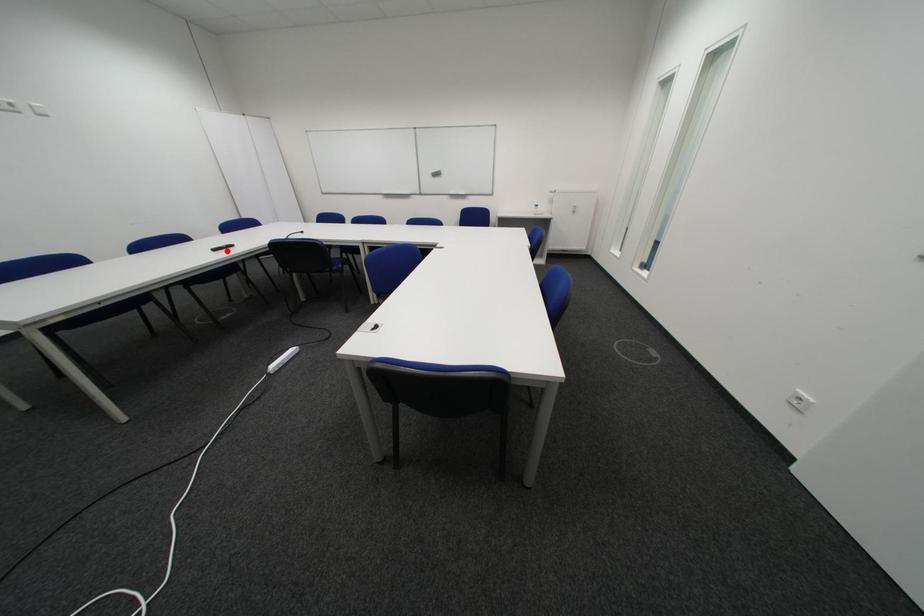
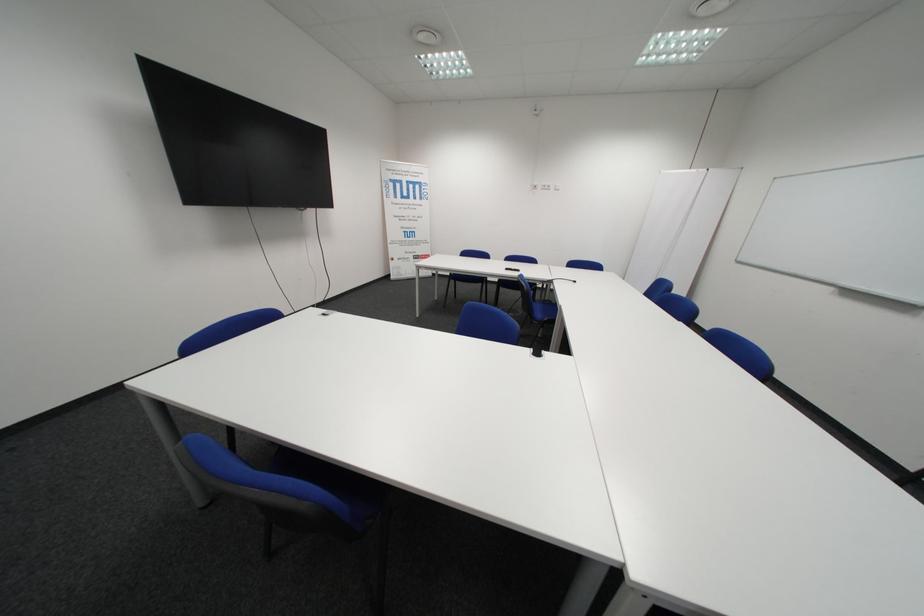
In the second image, find the point that corresponds to the highlighted location in the first image.

(518, 270)